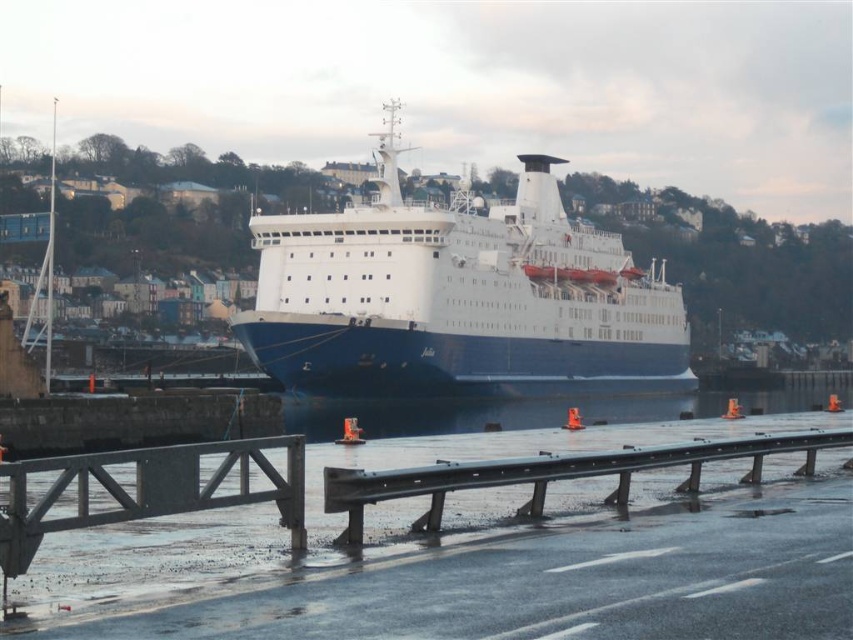
Is blue matte/clear ship at center to the right of blue rubber boat at center from the viewer's perspective?

Incorrect, blue matte/clear ship at center is not on the right side of blue rubber boat at center.

In the scene shown: Is blue matte/clear ship at center closer to the viewer compared to blue rubber boat at center?

That is False.

Does point (537, 339) come closer to viewer compared to point (791, 403)?

Yes, point (537, 339) is closer to viewer.

Locate an element on the screen. This screenshot has width=853, height=640. blue matte/clear ship at center is located at coordinates (457, 298).

Based on the photo, is smooth concrete dock at center thinner than blue rubber boat at center?

Indeed, smooth concrete dock at center has a lesser width compared to blue rubber boat at center.

Does smooth concrete dock at center appear on the right side of blue rubber boat at center?

Incorrect, smooth concrete dock at center is not on the right side of blue rubber boat at center.

Measure the distance between smooth concrete dock at center and camera.

They are 18.02 meters apart.

Identify the location of smooth concrete dock at center. This screenshot has width=853, height=640. (556, 474).

Can you confirm if blue matte/clear ship at center is shorter than smooth concrete dock at center?

In fact, blue matte/clear ship at center may be taller than smooth concrete dock at center.

Can you confirm if blue matte/clear ship at center is positioned to the right of smooth concrete dock at center?

Yes, blue matte/clear ship at center is to the right of smooth concrete dock at center.

Is point (259, 352) more distant than point (772, 435)?

Yes, it is behind point (772, 435).

The width and height of the screenshot is (853, 640). What are the coordinates of `blue matte/clear ship at center` in the screenshot? It's located at (457, 298).